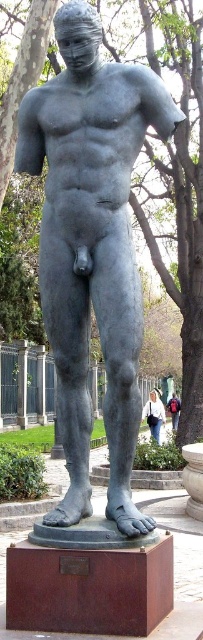
Who is lower down, matte gray statue at center or white cotton shirt at lower center?

white cotton shirt at lower center

Between matte gray statue at center and white cotton shirt at lower center, which one has less height?

Standing shorter between the two is white cotton shirt at lower center.

Is point (73, 312) behind point (161, 410)?

No, (73, 312) is in front of (161, 410).

Image resolution: width=203 pixels, height=640 pixels. I want to click on matte gray statue at center, so click(x=91, y=244).

Who is lower down, white cotton shirt at lower center or red backpack at center?

white cotton shirt at lower center is below.

Is white cotton shirt at lower center positioned at the back of red backpack at center?

Yes, white cotton shirt at lower center is behind red backpack at center.

Locate an element on the screen. The image size is (203, 640). white cotton shirt at lower center is located at coordinates (154, 413).

At what (x,y) coordinates should I click in order to perform the action: click on white cotton shirt at lower center. Please return your answer as a coordinate pair (x, y). The height and width of the screenshot is (640, 203). Looking at the image, I should click on (154, 413).

Looking at this image, is matte gray statue at center smaller than red backpack at center?

Actually, matte gray statue at center might be larger than red backpack at center.

Based on the photo, who is lower down, matte gray statue at center or red backpack at center?

red backpack at center

Is point (75, 83) positioned behind point (179, 401)?

No, it is not.

The image size is (203, 640). Find the location of `matte gray statue at center`. matte gray statue at center is located at coordinates (91, 244).